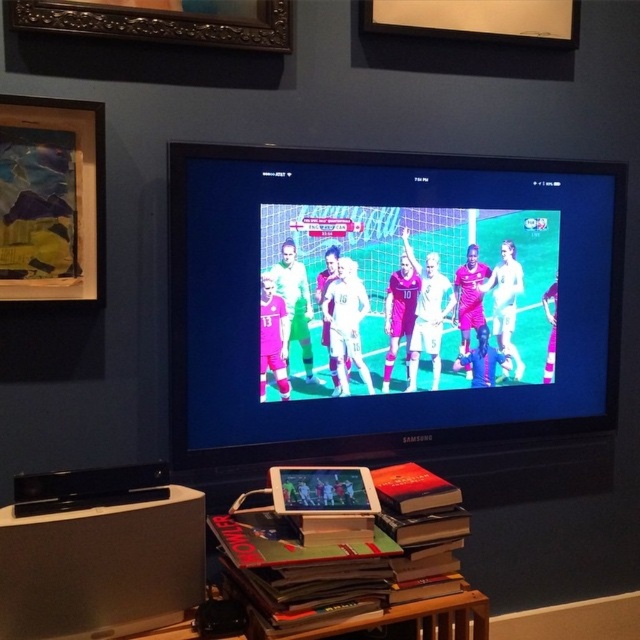
You are standing in the living room and want to determine which of the two points, point (84, 230) or point (573, 32), is closer to you. Based on the scene, which point is nearer?

Point (84, 230) is closer to the viewer than point (573, 32).

From the picture: You are standing in the living room looking at the TV. There are two points marked in the scene, one at coordinates point (x=264, y=225) and another at point (x=147, y=0). Which point is closer to you?

Point (x=264, y=225) is further to the viewer than point (x=147, y=0), so the point closer to you is point (x=147, y=0).